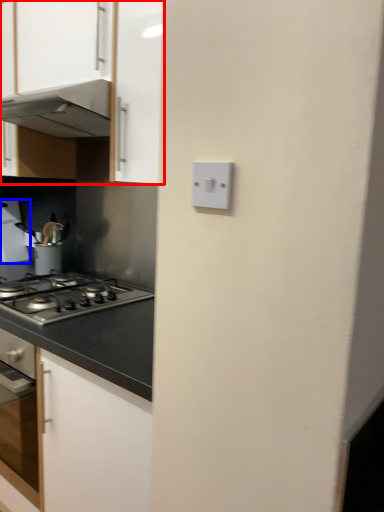
Question: Which point is closer to the camera, cabinetry (highlighted by a red box) or kitchen appliance (highlighted by a blue box)?

Choices:
 (A) cabinetry
 (B) kitchen appliance

Answer: (A)